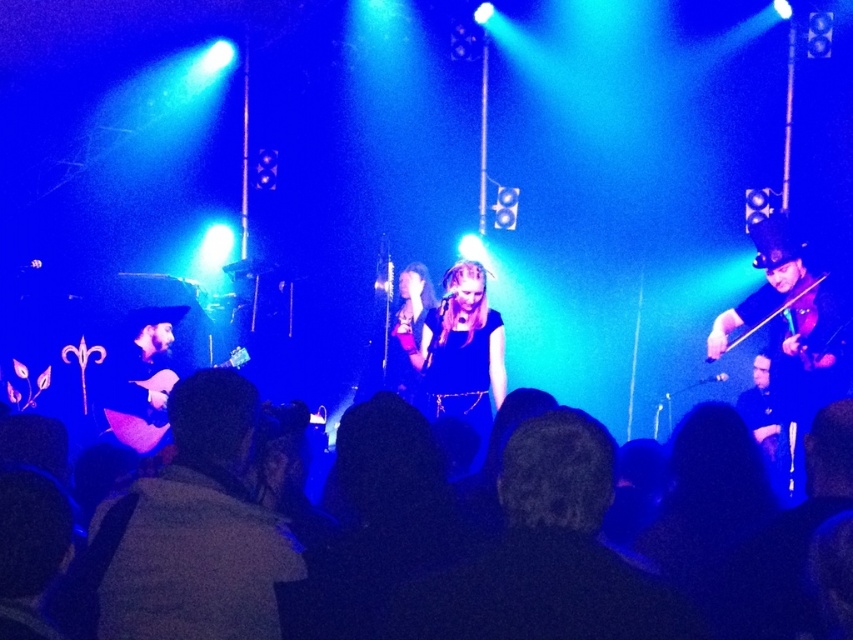
You are standing at the center of the stage and want to move towards the audience. Which point should you walk towards first, point (259, 556) or point (164, 369)?

You should walk towards point (164, 369) first because it is behind point (259, 556). Since you want to move towards the audience, you need to pass point (164, 369) first.

You are a stagehand who needs to place a 1.2 meter wide decorative panel between the shiny black violin at right and the shiny purple guitar at left. Based on their current positions, will the panel fit without overlapping either instrument?

The shiny black violin at right might be wider than the shiny purple guitar at left, so the panel might not fit properly. Check the actual width before placing it.

You are an audience member sitting in the front row. You notice the dark gray jacket at lower left and the shiny black violin at right. Which object is nearer to you?

The dark gray jacket at lower left is closer to the viewer than the shiny black violin at right.